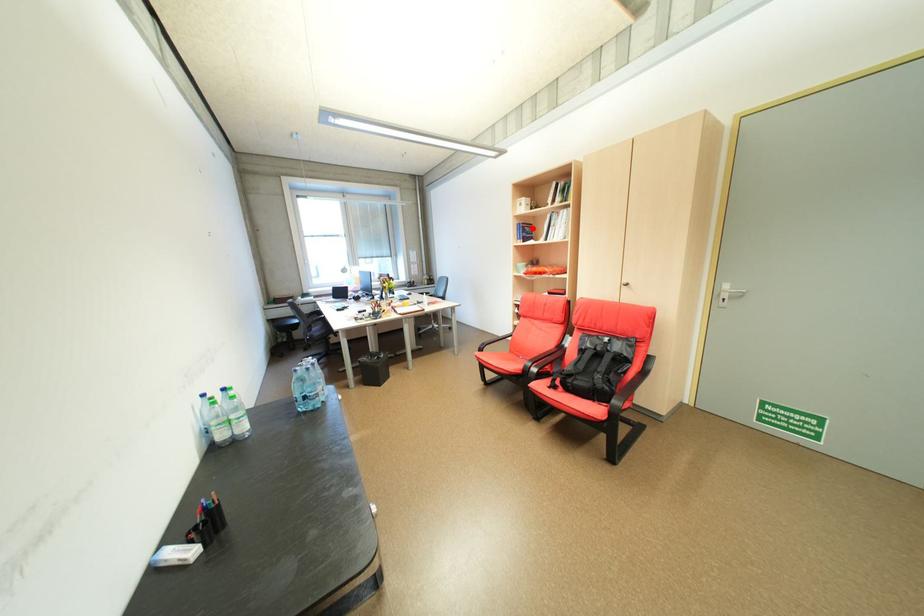
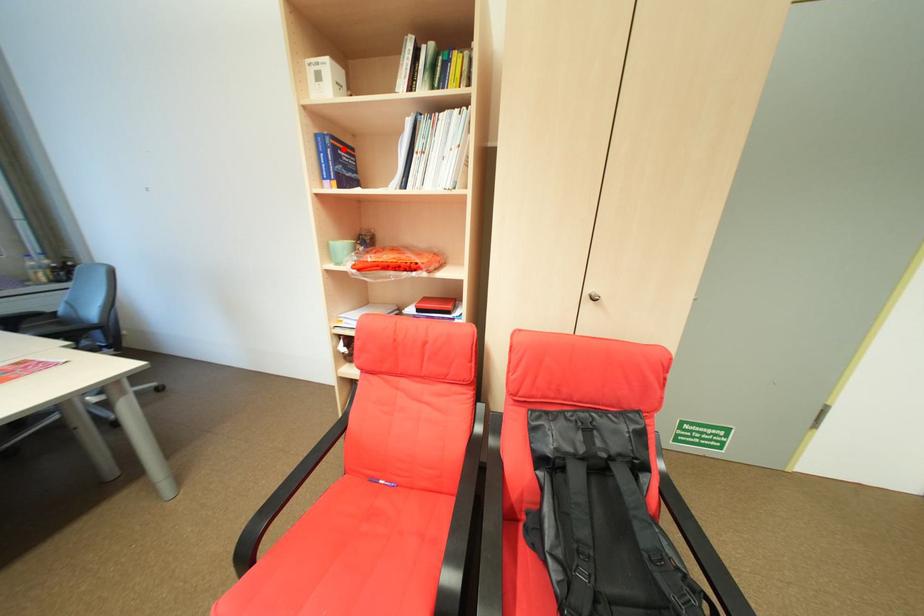
I am providing you with two images of the same scene from different viewpoints. A red point is marked on the first image and another point is marked on the second image. Is the red point in image1 aligned with the point shown in image2?

Yes